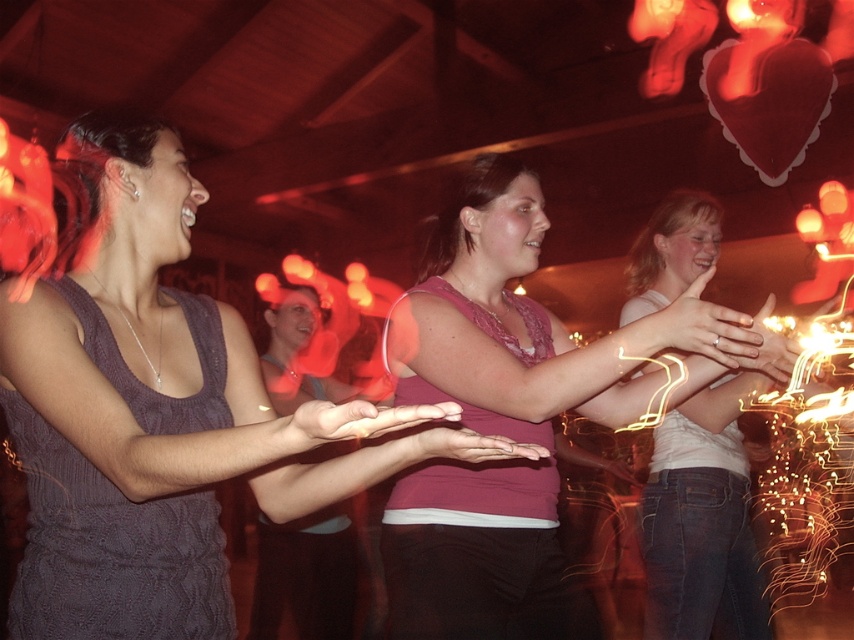
Does matte purple tank top at center come behind pink fabric shirt at center?

No, matte purple tank top at center is closer to the viewer.

Does matte purple tank top at center appear over pink fabric shirt at center?

Correct, matte purple tank top at center is located above pink fabric shirt at center.

Is point (88, 224) positioned behind point (708, 349)?

No, it is in front of (708, 349).

What are the coordinates of `matte purple tank top at center` in the screenshot? It's located at (x=158, y=408).

Which is more to the right, pink fabric shirt at center or white matte shirt at center?

Positioned to the right is white matte shirt at center.

Which is behind, point (447, 292) or point (706, 419)?

The point (706, 419) is behind.

Does point (437, 508) come farther from viewer compared to point (720, 436)?

No.

Find the location of a particular element. pink fabric shirt at center is located at coordinates (534, 324).

Who is shorter, matte purple tank top at center or white matte shirt at center?

With less height is matte purple tank top at center.

Which is above, matte purple tank top at center or white matte shirt at center?

matte purple tank top at center

Which is behind, point (144, 554) or point (673, 572)?

The point (673, 572) is behind.

Find the location of a particular element. The height and width of the screenshot is (640, 854). matte purple tank top at center is located at coordinates (158, 408).